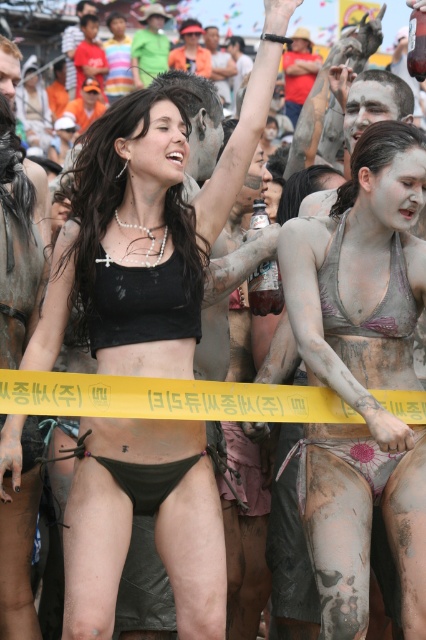
Can you confirm if matte pink bikini at center is positioned below black matte bikini bottom at center?

Yes, matte pink bikini at center is below black matte bikini bottom at center.

Between matte pink bikini at center and black matte bikini bottom at center, which one is positioned lower?

Positioned lower is matte pink bikini at center.

The height and width of the screenshot is (640, 426). What are the coordinates of `matte pink bikini at center` in the screenshot? It's located at (362, 374).

Can you confirm if black matte bikini bottom at center is bigger than purple metallic bikini top at center?

Yes.

Who is positioned more to the left, black matte bikini bottom at center or purple metallic bikini top at center?

black matte bikini bottom at center

This screenshot has height=640, width=426. What are the coordinates of `black matte bikini bottom at center` in the screenshot? It's located at (143, 189).

Identify the location of black matte bikini bottom at center. This screenshot has height=640, width=426. (143, 189).

What are the coordinates of `matte pink bikini at center` in the screenshot? It's located at (362, 374).

How far apart are matte pink bikini at center and purple metallic bikini top at center?

7.63 meters

Find the location of `matte pink bikini at center`. matte pink bikini at center is located at coordinates (362, 374).

Identify the location of matte pink bikini at center. This screenshot has width=426, height=640. 362,374.